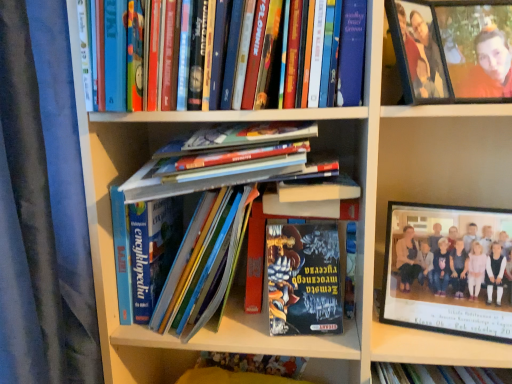
Question: Are black plastic frame at upper right and matte plastic frame at upper right making contact?

Choices:
 (A) no
 (B) yes

Answer: (A)

Question: Is black plastic frame at upper right outside matte plastic frame at upper right?

Choices:
 (A) no
 (B) yes

Answer: (B)

Question: Considering the relative positions of black plastic frame at upper right and matte plastic frame at upper right in the image provided, is black plastic frame at upper right to the right of matte plastic frame at upper right from the viewer's perspective?

Choices:
 (A) no
 (B) yes

Answer: (B)

Question: Does black plastic frame at upper right lie behind matte plastic frame at upper right?

Choices:
 (A) no
 (B) yes

Answer: (B)

Question: From a real-world perspective, is black plastic frame at upper right positioned over matte plastic frame at upper right based on gravity?

Choices:
 (A) no
 (B) yes

Answer: (A)

Question: Does point (287, 172) appear closer or farther from the camera than point (459, 26)?

Choices:
 (A) farther
 (B) closer

Answer: (B)

Question: Choose the correct answer: Is hardcover book at center, the 2th book from the top, inside wooden photo frame at upper right or outside it?

Choices:
 (A) outside
 (B) inside

Answer: (A)

Question: Considering their positions, is hardcover book at center, the 2th book from the top, located in front of or behind wooden photo frame at upper right?

Choices:
 (A) front
 (B) behind

Answer: (A)

Question: In terms of size, does hardcover book at center, which ranks as the fourth book in bottom-to-top order, appear bigger or smaller than wooden photo frame at upper right?

Choices:
 (A) small
 (B) big

Answer: (B)

Question: From the image's perspective, is black plastic frame at upper right located above or below hardcover book at upper center, arranged as the 1th book when viewed from the top?

Choices:
 (A) above
 (B) below

Answer: (B)

Question: Is black plastic frame at upper right inside or outside of hardcover book at upper center, the 5th book when ordered from bottom to top?

Choices:
 (A) outside
 (B) inside

Answer: (A)

Question: Is black plastic frame at upper right taller or shorter than hardcover book at upper center, the 5th book when ordered from bottom to top?

Choices:
 (A) tall
 (B) short

Answer: (A)

Question: In the image, is black plastic frame at upper right positioned in front of or behind hardcover book at upper center, arranged as the 1th book when viewed from the top?

Choices:
 (A) front
 (B) behind

Answer: (B)

Question: From the image's perspective, is hardcover book at center, the 2th book from the top, above or below shiny metallic book at center, which is the 5th book in top-to-bottom order?

Choices:
 (A) above
 (B) below

Answer: (A)

Question: Considering the positions of hardcover book at center, which ranks as the fourth book in bottom-to-top order, and shiny metallic book at center, which is the 5th book in top-to-bottom order, in the image, is hardcover book at center, which ranks as the fourth book in bottom-to-top order, taller or shorter than shiny metallic book at center, which is the 5th book in top-to-bottom order,?

Choices:
 (A) tall
 (B) short

Answer: (B)